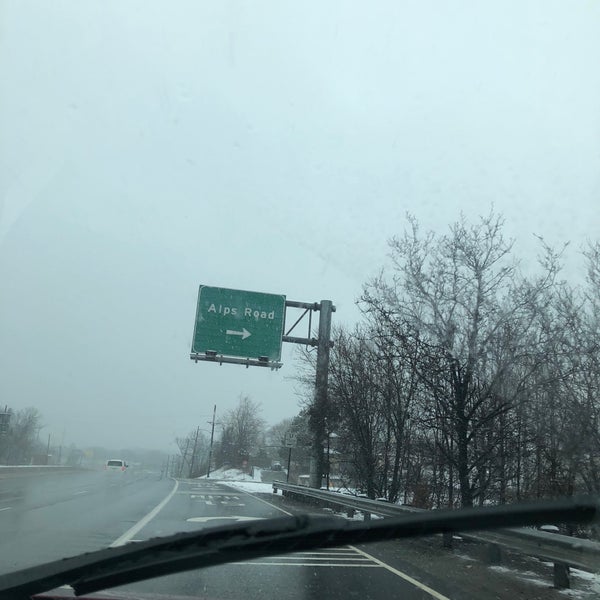
Locate an element on the screen. The image size is (600, 600). safety rail is located at coordinates (374, 508).